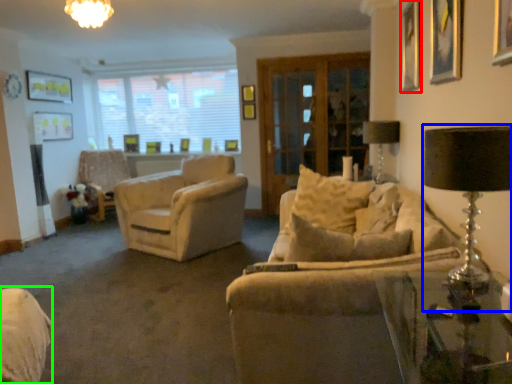
Question: Based on their relative distances, which object is nearer to picture frame (highlighted by a red box)? Choose from table lamp (highlighted by a blue box) and swivel chair (highlighted by a green box).

Choices:
 (A) table lamp
 (B) swivel chair

Answer: (A)